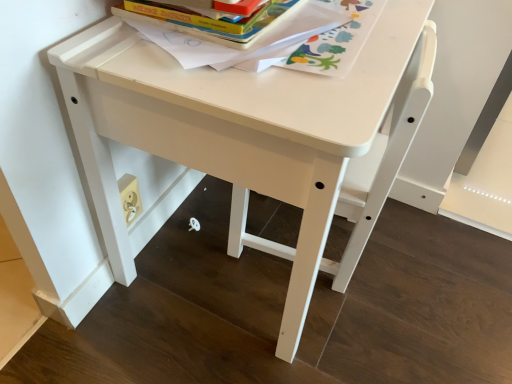
The height and width of the screenshot is (384, 512). What are the coordinates of `vacant area that is in front of white plastic chair at center` in the screenshot? It's located at (328, 344).